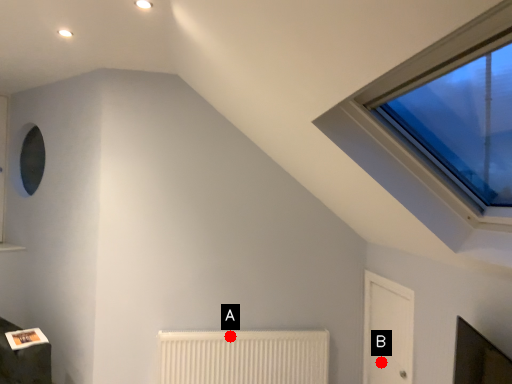
Question: Two points are circled on the image, labeled by A and B beside each circle. Which point is closer to the camera?

Choices:
 (A) A is closer
 (B) B is closer

Answer: (B)